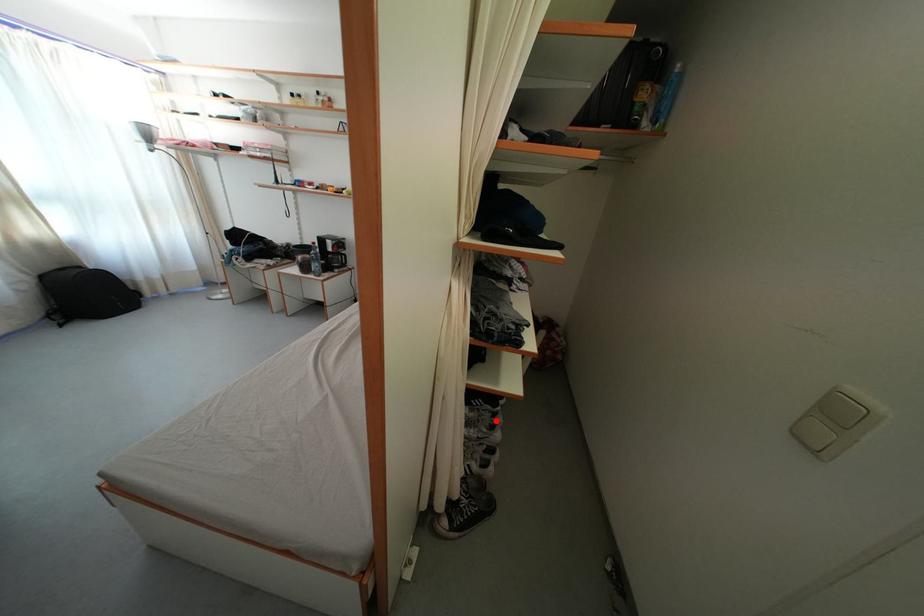
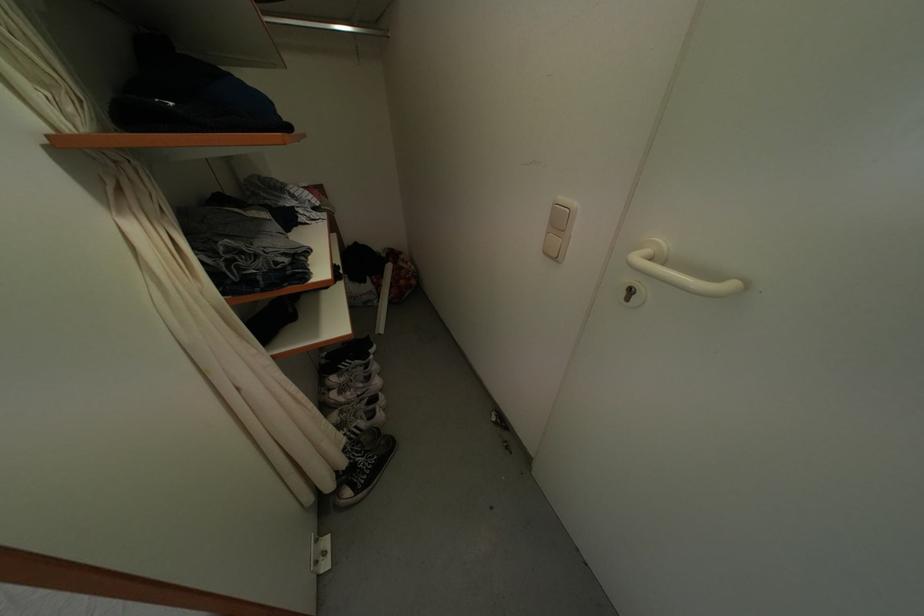
Question: I am providing you with two images of the same scene from different viewpoints. A red point is shown in image1. For the corresponding object point in image2, is it positioned nearer or farther from the camera?

Choices:
 (A) Nearer
 (B) Farther

Answer: (A)